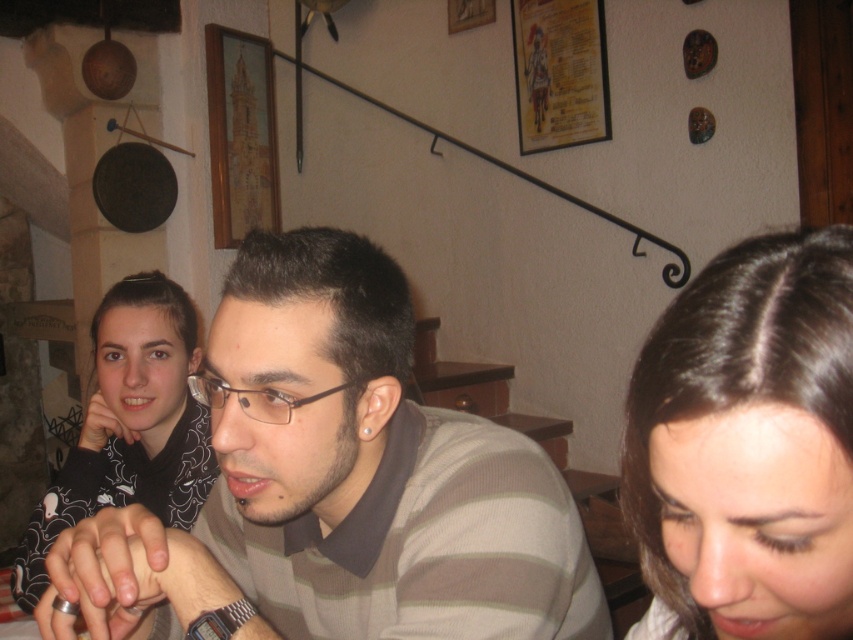
Who is positioned more to the right, striped cotton shirt at center or black matte shirt at left?

striped cotton shirt at center

Identify the location of striped cotton shirt at center. Image resolution: width=853 pixels, height=640 pixels. (338, 484).

This screenshot has height=640, width=853. I want to click on striped cotton shirt at center, so click(338, 484).

Is dark brown hair at lower right closer to the viewer compared to black matte shirt at left?

Yes, dark brown hair at lower right is closer to the viewer.

Does dark brown hair at lower right appear on the right side of black matte shirt at left?

Yes, dark brown hair at lower right is to the right of black matte shirt at left.

Which is in front, point (741, 518) or point (196, 323)?

Positioned in front is point (741, 518).

At what (x,y) coordinates should I click in order to perform the action: click on dark brown hair at lower right. Please return your answer as a coordinate pair (x, y). Image resolution: width=853 pixels, height=640 pixels. Looking at the image, I should click on (747, 444).

Describe the element at coordinates (338, 484) in the screenshot. I see `striped cotton shirt at center` at that location.

Does striped cotton shirt at center have a greater width compared to dark brown hair at lower right?

Yes, striped cotton shirt at center is wider than dark brown hair at lower right.

Describe the element at coordinates (338, 484) in the screenshot. The width and height of the screenshot is (853, 640). I see `striped cotton shirt at center` at that location.

Identify the location of striped cotton shirt at center. (338, 484).